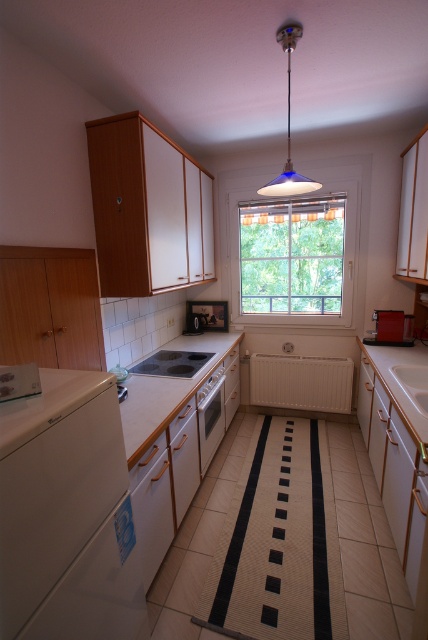
Which of these two, white glossy countertop at right or matte black oven at center, stands taller?

Standing taller between the two is white glossy countertop at right.

Measure the distance between white glossy countertop at right and matte black oven at center.

white glossy countertop at right is 5.57 feet away from matte black oven at center.

Which is behind, point (398, 408) or point (187, 326)?

Positioned behind is point (187, 326).

Locate an element on the screen. This screenshot has width=428, height=640. white glossy countertop at right is located at coordinates (404, 384).

This screenshot has width=428, height=640. In order to click on white glossy countertop at right in this screenshot , I will do `click(404, 384)`.

Does point (422, 360) come behind point (217, 428)?

That is False.

Identify the location of white glossy countertop at right. (404, 384).

Can you confirm if white laminate countertop at center is wider than black glass stove at center?

Yes, white laminate countertop at center is wider than black glass stove at center.

Is point (178, 385) positioned in front of point (137, 364)?

That is True.

The height and width of the screenshot is (640, 428). Identify the location of white laminate countertop at center. (166, 392).

Find the location of a particular element. white laminate countertop at center is located at coordinates (166, 392).